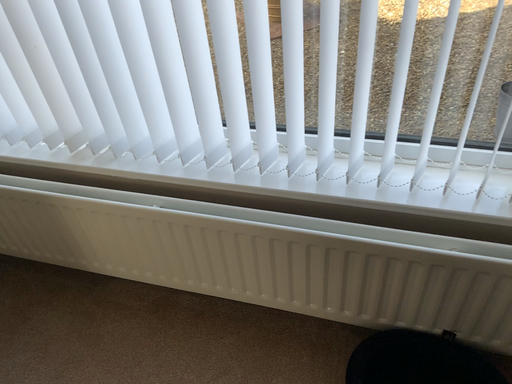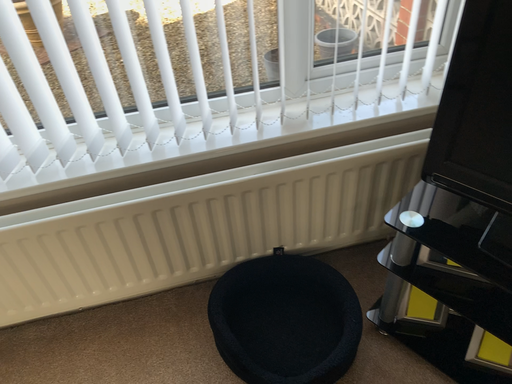
Question: Which way did the camera rotate in the video?

Choices:
 (A) rotated left
 (B) rotated right

Answer: (B)